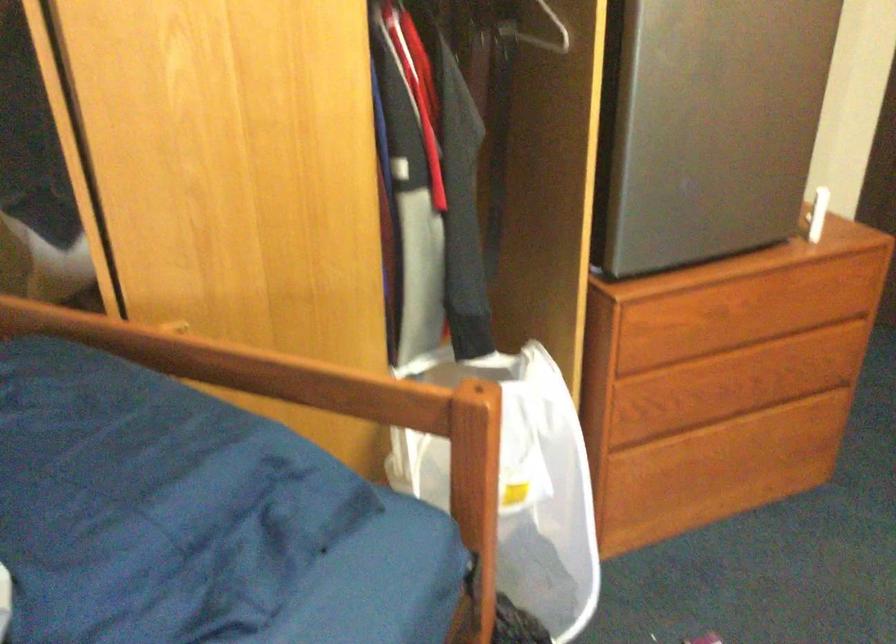
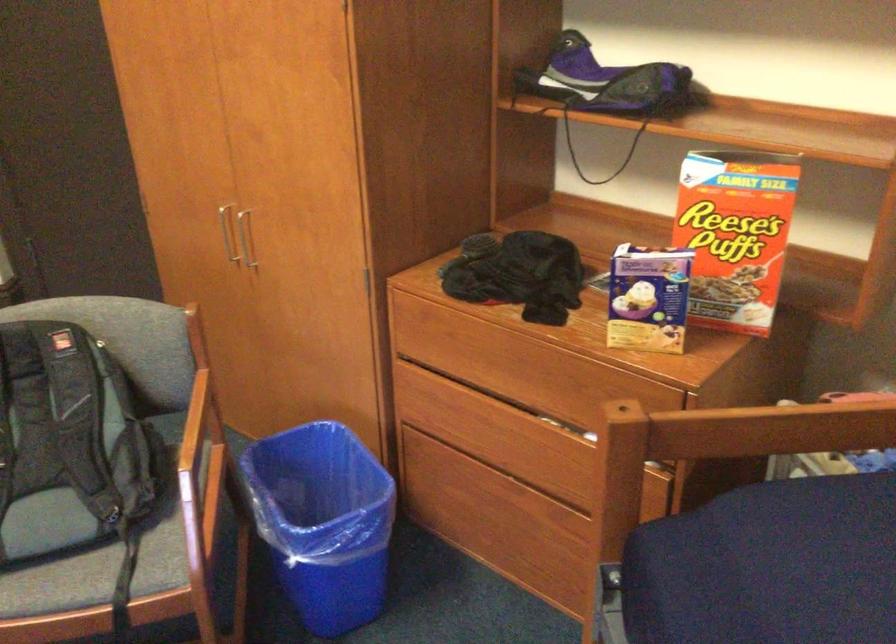
In a continuous first-person perspective shot, in which direction is the camera moving?

The cameraman walked toward right, backward.